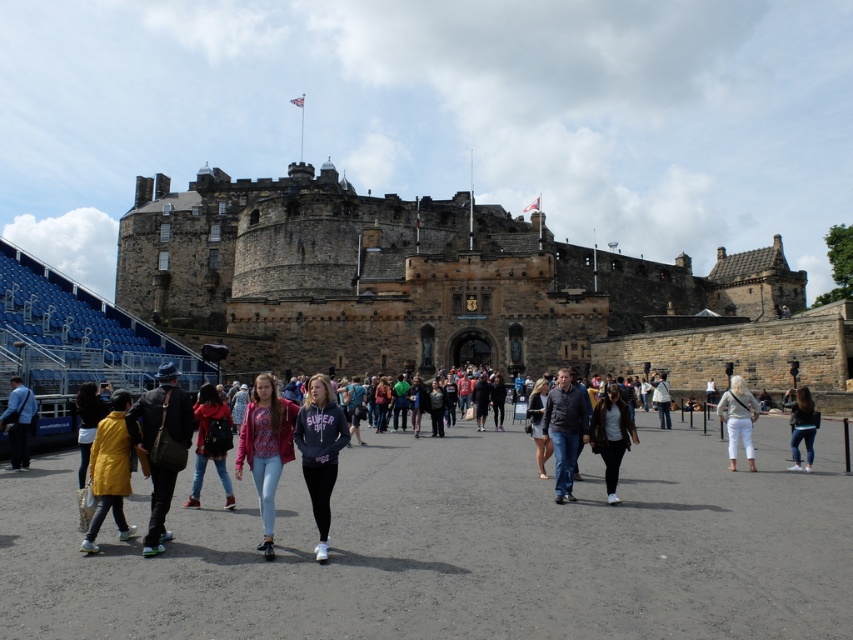
You are a tourist standing at the entrance of Edinburgh Castle and notice two people in the crowd. One is wearing a matte black jacket at lower left and the other a dark gray sweater at center. Which person is closer to you?

The matte black jacket at lower left is closer to you because it is in front of the dark gray sweater at center.

You are a photographer planning to take a group photo of tourists at Edinburgh Castle. You notice a person wearing a matte black jacket at lower left and another wearing a dark gray sweater at center. Which clothing item is positioned higher in the image?

The matte black jacket at lower left is taller than the dark gray sweater at center, so the matte black jacket at lower left is positioned higher in the image.

You are a photographer trying to capture a candid shot of the crowd at Edinburgh Castle. You notice two people wearing the matte black jacket at lower left and the dark gray sweater at center. Which clothing item would appear bigger in your photo?

The matte black jacket at lower left would appear bigger in the photo because it has a larger size than the dark gray sweater at center.